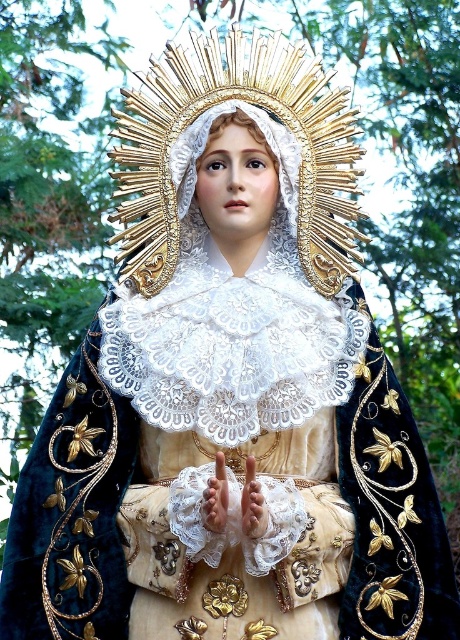
You are an art conservator examining the image of a religious figure. You notice two hands at the center of the image. Which hand is closer to you, the smooth white hand at center or the gold textured hand at center?

The smooth white hand at center is closer to you as it is positioned in front of the gold textured hand at center.

Based on the scene description, where is the gold textured halo at center located in terms of its 2D coordinates?

The gold textured halo at center is located at the 2D coordinates of point (220, 108).